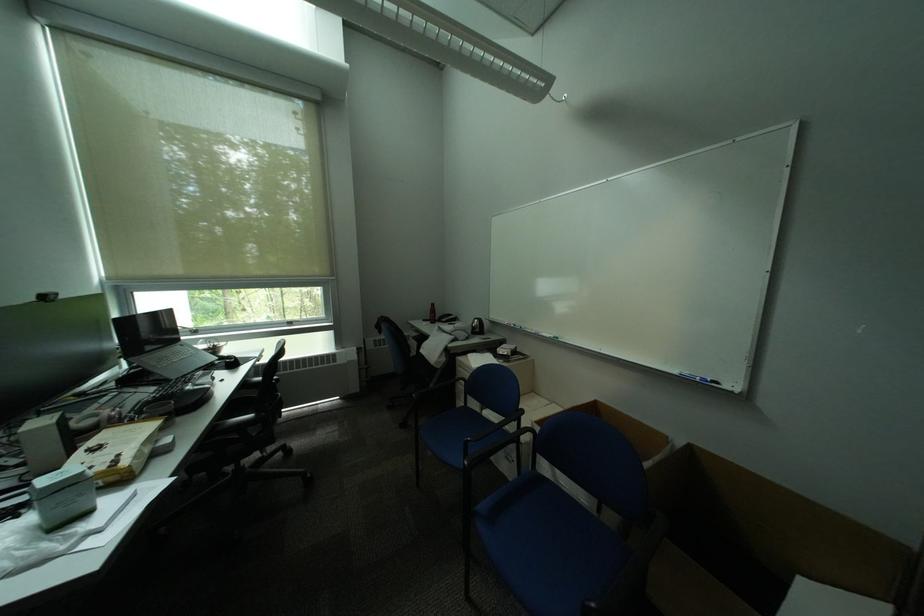
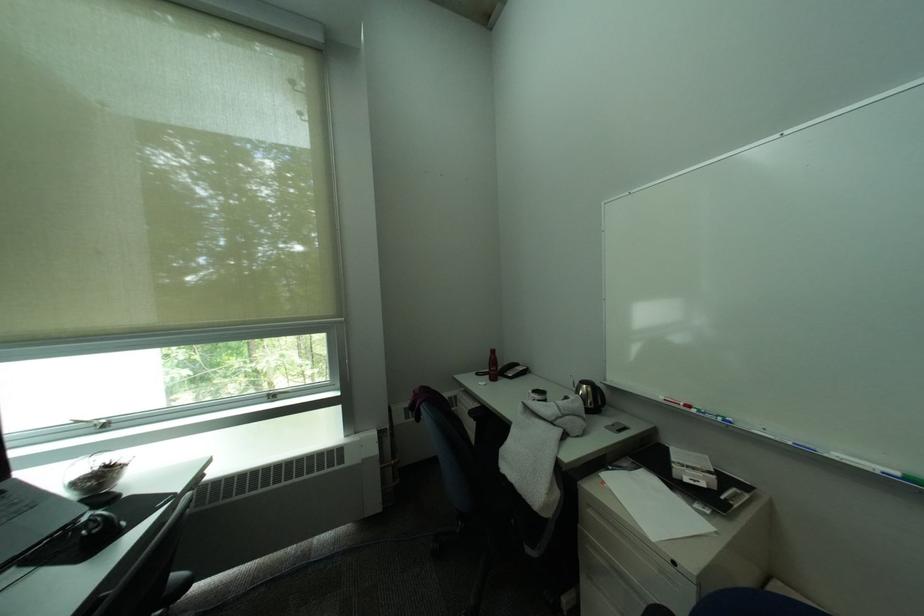
In the second image, find the point that corresponds to point 442,317 in the first image.

(503, 370)